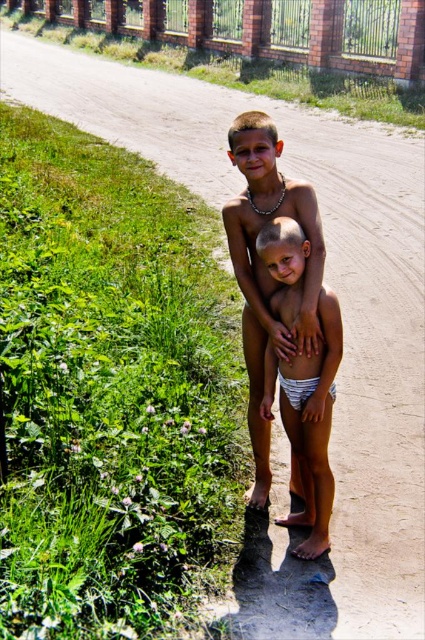
Can you confirm if smooth skin boy at center is positioned above white striped fabric diaper at center?

Yes.

Between point (314, 276) and point (300, 404), which one is positioned in front?

Point (314, 276) is more forward.

Which is behind, point (254, 394) or point (300, 381)?

Positioned behind is point (254, 394).

This screenshot has width=425, height=640. What are the coordinates of `smooth skin boy at center` in the screenshot? It's located at (266, 269).

Which is more to the left, smooth skin boy at center or white striped underwear at center?

Positioned to the left is smooth skin boy at center.

Between smooth skin boy at center and white striped underwear at center, which one is positioned higher?

smooth skin boy at center is above.

Who is more forward, (288, 355) or (331, 385)?

Positioned in front is point (288, 355).

In order to click on smooth skin boy at center in this screenshot , I will do `click(266, 269)`.

From the picture: Who is more forward, (289, 314) or (331, 387)?

Point (289, 314)

Consider the image. Can you confirm if white striped underwear at center is smaller than white striped fabric diaper at center?

No.

Is point (283, 266) more distant than point (331, 385)?

That is False.

What are the coordinates of `white striped underwear at center` in the screenshot? It's located at (308, 422).